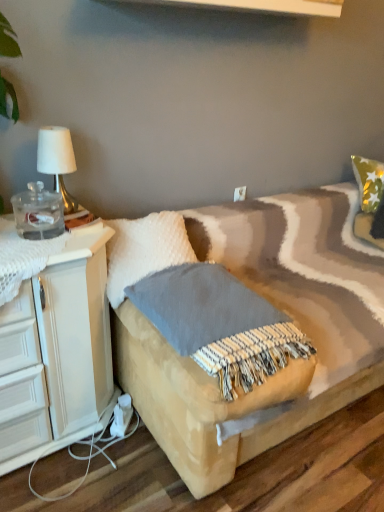
What do you see at coordinates (240, 193) in the screenshot? The width and height of the screenshot is (384, 512). I see `white plastic electric outlet at upper center` at bounding box center [240, 193].

I want to click on gold metallic table lamp at upper left, so click(x=57, y=160).

In order to click on white fluffy pillow at center in this screenshot , I will do `click(144, 250)`.

Find the location of a particular element. The image size is (384, 512). white plastic electric outlet at upper center is located at coordinates (240, 193).

From the image's perspective, which one is positioned higher, white plastic electric outlet at upper center or white fluffy pillow at center?

From the image's view, white plastic electric outlet at upper center is above.

Considering the sizes of objects white plastic electric outlet at upper center and white fluffy pillow at center in the image provided, who is shorter, white plastic electric outlet at upper center or white fluffy pillow at center?

With less height is white plastic electric outlet at upper center.

Considering the positions of objects white plastic electric outlet at upper center and white fluffy pillow at center in the image provided, who is behind, white plastic electric outlet at upper center or white fluffy pillow at center?

white plastic electric outlet at upper center is further from the camera.

I want to click on electric outlet located behind the white fluffy pillow at center, so click(x=240, y=193).

Which object is positioned more to the right, gold metallic table lamp at upper left or white plastic electric outlet at upper center?

white plastic electric outlet at upper center.

From the image's perspective, which is above, gold metallic table lamp at upper left or white plastic electric outlet at upper center?

gold metallic table lamp at upper left, from the image's perspective.

Between gold metallic table lamp at upper left and white plastic electric outlet at upper center, which one is positioned behind?

Positioned behind is white plastic electric outlet at upper center.

Is gold metallic table lamp at upper left next to white plastic electric outlet at upper center and touching it?

No, gold metallic table lamp at upper left is not with white plastic electric outlet at upper center.

Which of these two, gold metallic table lamp at upper left or white fluffy pillow at center, is smaller?

With smaller size is gold metallic table lamp at upper left.

Would you say gold metallic table lamp at upper left is inside or outside white fluffy pillow at center?

gold metallic table lamp at upper left is not inside white fluffy pillow at center, it's outside.

Image resolution: width=384 pixels, height=512 pixels. I want to click on table lamp behind the white fluffy pillow at center, so click(57, 160).

Does point (76, 201) come in front of point (117, 302)?

No, (76, 201) is further to viewer.

Which point is more forward, (257,365) or (59,186)?

Positioned in front is point (257,365).

Which object is further away from the camera, textured beige blanket at center or gold metallic table lamp at upper left?

gold metallic table lamp at upper left is more distant.

Considering the sizes of objects textured beige blanket at center and gold metallic table lamp at upper left in the image provided, who is shorter, textured beige blanket at center or gold metallic table lamp at upper left?

With less height is textured beige blanket at center.

Is gold metallic table lamp at upper left surrounded by textured beige blanket at center?

No, gold metallic table lamp at upper left is not a part of textured beige blanket at center.

Where is `electric outlet on the right of textured beige blanket at center`? electric outlet on the right of textured beige blanket at center is located at coordinates (240, 193).

Considering the sizes of objects textured beige blanket at center and white plastic electric outlet at upper center in the image provided, who is shorter, textured beige blanket at center or white plastic electric outlet at upper center?

Standing shorter between the two is white plastic electric outlet at upper center.

Looking at their sizes, would you say textured beige blanket at center is wider or thinner than white plastic electric outlet at upper center?

Clearly, textured beige blanket at center has more width compared to white plastic electric outlet at upper center.

Is textured beige blanket at center in contact with white plastic electric outlet at upper center?

textured beige blanket at center is not next to white plastic electric outlet at upper center, and they're not touching.

From the image's perspective, is white fluffy pillow at center over gold metallic table lamp at upper left?

No.

From a real-world perspective, is white fluffy pillow at center physically above gold metallic table lamp at upper left?

No, from a real-world perspective, white fluffy pillow at center is not on top of gold metallic table lamp at upper left.

Which object is positioned more to the right, white fluffy pillow at center or gold metallic table lamp at upper left?

white fluffy pillow at center.

Is white fluffy pillow at center bigger than gold metallic table lamp at upper left?

Indeed, white fluffy pillow at center has a larger size compared to gold metallic table lamp at upper left.

Does point (51, 161) come in front of point (247, 361)?

No, it is behind (247, 361).

Is gold metallic table lamp at upper left located outside textured beige blanket at center?

Yes, gold metallic table lamp at upper left is located beyond the bounds of textured beige blanket at center.

From the image's perspective, is gold metallic table lamp at upper left located above or below textured beige blanket at center?

gold metallic table lamp at upper left is above textured beige blanket at center.

Considering the sizes of objects gold metallic table lamp at upper left and textured beige blanket at center in the image provided, who is bigger, gold metallic table lamp at upper left or textured beige blanket at center?

With larger size is textured beige blanket at center.

Where is `electric outlet lying on the right of white fluffy pillow at center`? electric outlet lying on the right of white fluffy pillow at center is located at coordinates (240, 193).

This screenshot has height=512, width=384. I want to click on table lamp lying in front of the white plastic electric outlet at upper center, so click(x=57, y=160).

Looking at the image, which one is located closer to textured beige blanket at center, white plastic electric outlet at upper center or gold metallic table lamp at upper left?

gold metallic table lamp at upper left.

Considering their positions, is gold metallic table lamp at upper left positioned closer to textured beige blanket at center than white plastic electric outlet at upper center?

Based on the image, gold metallic table lamp at upper left appears to be nearer to textured beige blanket at center.

Looking at the image, which one is located closer to gold metallic table lamp at upper left, white plastic electric outlet at upper center or white fluffy pillow at center?

The object closer to gold metallic table lamp at upper left is white fluffy pillow at center.

Considering their positions, is white plastic electric outlet at upper center positioned closer to gold metallic table lamp at upper left than textured beige blanket at center?

Based on the image, textured beige blanket at center appears to be nearer to gold metallic table lamp at upper left.

From the image, which object appears to be nearer to white fluffy pillow at center, white plastic electric outlet at upper center or gold metallic table lamp at upper left?

gold metallic table lamp at upper left.

Estimate the real-world distances between objects in this image. Which object is closer to white fluffy pillow at center, gold metallic table lamp at upper left or white plastic electric outlet at upper center?

gold metallic table lamp at upper left is closer to white fluffy pillow at center.

When comparing their distances from gold metallic table lamp at upper left, does white fluffy pillow at center or textured beige blanket at center seem closer?

white fluffy pillow at center.

Which object lies further to the anchor point textured beige blanket at center, white fluffy pillow at center or gold metallic table lamp at upper left?

Among the two, gold metallic table lamp at upper left is located further to textured beige blanket at center.

Where is `pillow located between gold metallic table lamp at upper left and textured beige blanket at center in the left-right direction`? pillow located between gold metallic table lamp at upper left and textured beige blanket at center in the left-right direction is located at coordinates (144, 250).

The height and width of the screenshot is (512, 384). I want to click on table lamp located between textured beige blanket at center and white plastic electric outlet at upper center in the depth direction, so click(x=57, y=160).

The height and width of the screenshot is (512, 384). Find the location of `pillow between textured beige blanket at center and white plastic electric outlet at upper center in the front-back direction`. pillow between textured beige blanket at center and white plastic electric outlet at upper center in the front-back direction is located at coordinates (144, 250).

Find the location of a particular element. table lamp positioned between white fluffy pillow at center and white plastic electric outlet at upper center from near to far is located at coordinates (57, 160).